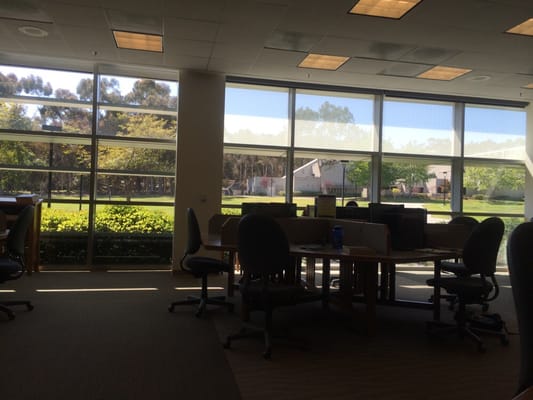
At what (x,y) coordinates should I click in order to perform the action: click on column. Please return your answer as a coordinate pair (x, y). Looking at the image, I should click on (203, 145).